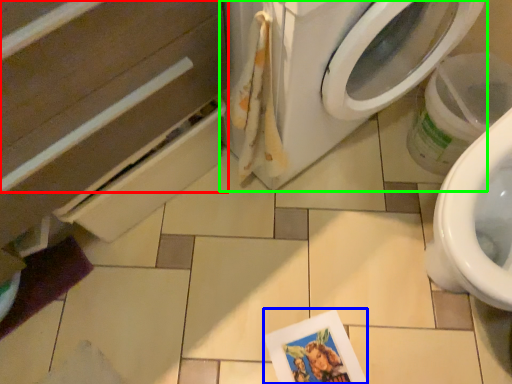
Question: Estimate the real-world distances between objects in this image. Which object is closer to drawer (highlighted by a red box), postcard (highlighted by a blue box) or washing machine (highlighted by a green box)?

Choices:
 (A) postcard
 (B) washing machine

Answer: (B)